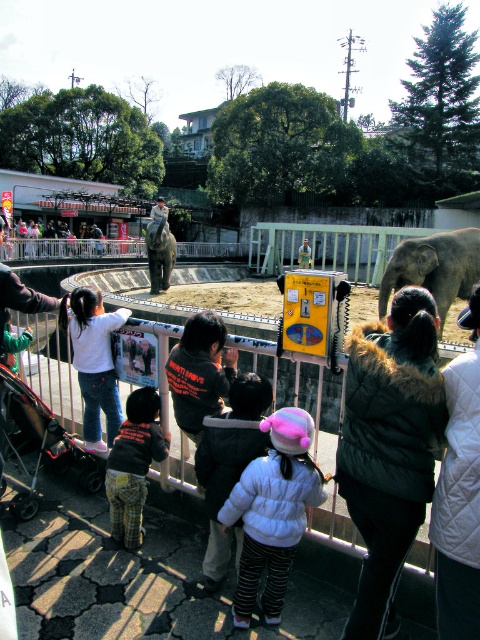
Can you confirm if dark green fur coat at center is positioned to the left of white quilted jacket at center?

Yes, dark green fur coat at center is to the left of white quilted jacket at center.

Is point (368, 394) farther from viewer compared to point (462, 580)?

Yes.

Is point (432, 352) more distant than point (440, 548)?

Yes.

You are a GUI agent. You are given a task and a screenshot of the screen. Output one action in this format:
    pyautogui.click(x=<x>, y=<y>)
    Task: Click on the dark green fur coat at center
    This screenshot has width=480, height=640.
    Given the screenshot: What is the action you would take?
    pyautogui.click(x=389, y=449)

Is flannel plaid pants at center above light brown fur horse at center?

Incorrect, flannel plaid pants at center is not positioned above light brown fur horse at center.

Can you confirm if flannel plaid pants at center is positioned to the left of light brown fur horse at center?

In fact, flannel plaid pants at center is to the right of light brown fur horse at center.

Between point (127, 531) and point (158, 208), which one is positioned in front?

Positioned in front is point (127, 531).

I want to click on flannel plaid pants at center, so click(x=133, y=465).

Does white cotton shirt at left lie in front of light brown fur horse at center?

Yes, white cotton shirt at left is closer to the viewer.

Can you confirm if white cotton shirt at left is positioned to the right of light brown fur horse at center?

Correct, you'll find white cotton shirt at left to the right of light brown fur horse at center.

Who is more distant from viewer, (87, 337) or (154, 234)?

The point (154, 234) is more distant.

Locate an element on the screen. The width and height of the screenshot is (480, 640). white cotton shirt at left is located at coordinates (94, 362).